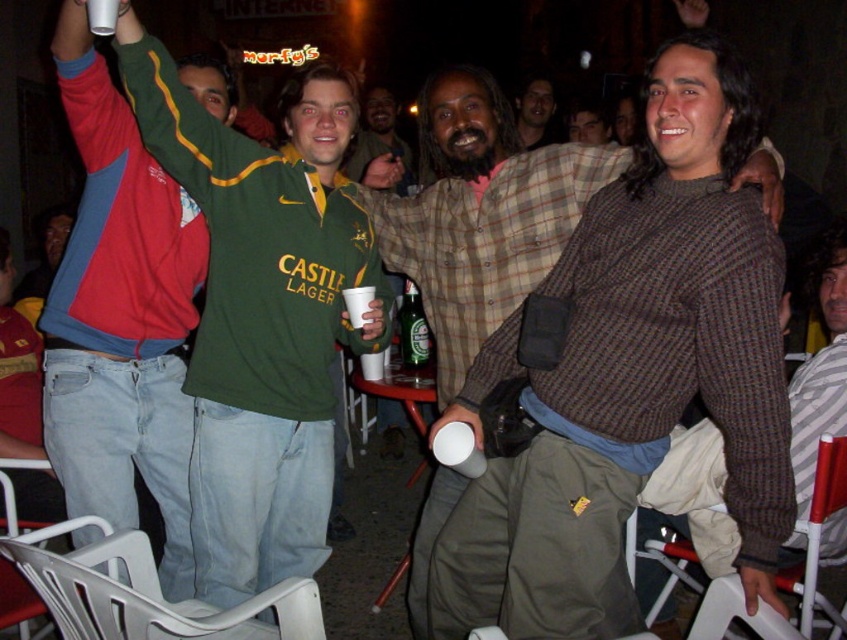
You are organizing a photo shoot and need to arrange two green outfits in the center of the image. The green jersey at center and the matte green shirt at center must be placed such that one is larger than the other. Based on the scene description, which one should be made larger?

The green jersey at center should be made larger since it already has a larger size compared to the matte green shirt at center according to the description.

You are at the party and want to take a photo of both the point at (266, 458) and the point at (383, 92). Which point should you focus on first to ensure both are in the frame?

You should focus on point (266, 458) first because it is in front of point (383, 92), allowing both to be captured in the frame.